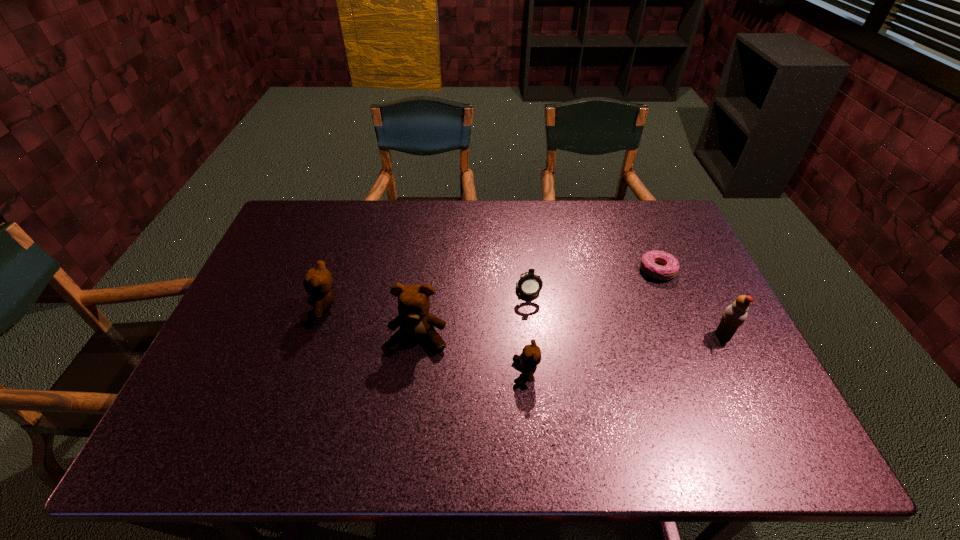
Where is `vacant space at the near right corner of the desktop`? vacant space at the near right corner of the desktop is located at coordinates (719, 379).

Find the location of a particular element. This screenshot has height=540, width=960. empty space between the compass and the doughnut is located at coordinates (592, 278).

I want to click on vacant area that lies between the fifth object from right to left and the rightmost object, so click(x=570, y=337).

Where is `vacant area that lies between the compass and the rightmost object`? The image size is (960, 540). vacant area that lies between the compass and the rightmost object is located at coordinates (626, 310).

Image resolution: width=960 pixels, height=540 pixels. I want to click on empty space between the rightmost object and the doughnut, so click(x=690, y=302).

What are the coordinates of `free space between the second teddy bear from left to right and the shortest object` in the screenshot? It's located at [x=538, y=304].

Where is `vacant space that is in between the nearest teddy bear and the icecream`? The width and height of the screenshot is (960, 540). vacant space that is in between the nearest teddy bear and the icecream is located at coordinates (625, 354).

Locate an element on the screen. free space between the compass and the rightmost object is located at coordinates (626, 310).

Find the location of a particular element. Image resolution: width=960 pixels, height=540 pixels. vacant area that lies between the icecream and the compass is located at coordinates (626, 310).

At what (x,y) coordinates should I click in order to perform the action: click on vacant region between the compass and the rightmost object. Please return your answer as a coordinate pair (x, y). The image size is (960, 540). Looking at the image, I should click on (626, 310).